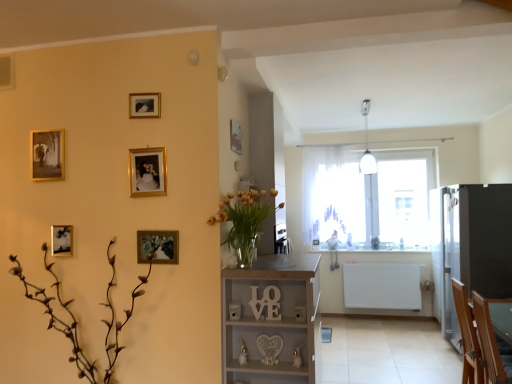
The height and width of the screenshot is (384, 512). What do you see at coordinates (148, 172) in the screenshot?
I see `gold metallic picture frame at upper center, the third picture frame positioned from the right` at bounding box center [148, 172].

The width and height of the screenshot is (512, 384). What do you see at coordinates (367, 145) in the screenshot? I see `white plastic light fixture at upper center` at bounding box center [367, 145].

Describe the element at coordinates (234, 137) in the screenshot. Image resolution: width=512 pixels, height=384 pixels. I see `gold metallic picture frame at upper center, positioned as the sixth picture frame in left-to-right order` at that location.

How much space does gold metallic picture frame at upper center, positioned as the sixth picture frame in left-to-right order, occupy horizontally?

2.14 centimeters.

How much space does gold metallic picture frame at upper center, which ranks as the 3th picture frame in left-to-right order, occupy vertically?

gold metallic picture frame at upper center, which ranks as the 3th picture frame in left-to-right order, is 6.73 inches tall.

Where is `satin black fridge at right`? satin black fridge at right is located at coordinates (470, 246).

Which is more to the left, white sheer curtain at center or gold metallic picture frame at upper center, positioned as the sixth picture frame in left-to-right order?

gold metallic picture frame at upper center, positioned as the sixth picture frame in left-to-right order, is more to the left.

Are white sheer curtain at center and gold metallic picture frame at upper center, the sixth picture frame viewed from the front, beside each other?

No, white sheer curtain at center is not next to gold metallic picture frame at upper center, the sixth picture frame viewed from the front.

Measure the distance from white sheer curtain at center to gold metallic picture frame at upper center, which is the first picture frame from back to front.

The distance of white sheer curtain at center from gold metallic picture frame at upper center, which is the first picture frame from back to front, is 3.68 meters.

Does gold metallic picture frame at upper center, which is the first picture frame from back to front, have a smaller size compared to brown matte plant at lower left?

Yes.

Is gold metallic picture frame at upper center, the sixth picture frame viewed from the front, looking in the opposite direction of brown matte plant at lower left?

No.

Where is `plant that appears below the gold metallic picture frame at upper center, which is the first picture frame from back to front (from the image's perspective)`? The height and width of the screenshot is (384, 512). plant that appears below the gold metallic picture frame at upper center, which is the first picture frame from back to front (from the image's perspective) is located at coordinates (75, 318).

From a real-world perspective, which object stands above the other?

From a 3D spatial view, gold metallic picture frame at upper center, the sixth picture frame viewed from the front, is above.

Is gold metallic picture frame at upper center, which is counted as the fourth picture frame, starting from the left, inside gold metallic picture frame at upper center, positioned as the sixth picture frame in left-to-right order?

No, gold metallic picture frame at upper center, which is counted as the fourth picture frame, starting from the left, is not inside gold metallic picture frame at upper center, positioned as the sixth picture frame in left-to-right order.

In the image, is gold metallic picture frame at upper center, the first picture frame viewed from the right, on the left side or the right side of gold metallic picture frame at upper center, the fifth picture frame from the back?

gold metallic picture frame at upper center, the first picture frame viewed from the right, is to the right of gold metallic picture frame at upper center, the fifth picture frame from the back.

Consider the image. Could you tell me if transparent glass window at center is turned towards satin black fridge at right?

Yes, transparent glass window at center faces towards satin black fridge at right.

Considering the sizes of transparent glass window at center and satin black fridge at right in the image, is transparent glass window at center bigger or smaller than satin black fridge at right?

transparent glass window at center is smaller than satin black fridge at right.

Is point (399, 154) less distant than point (446, 243)?

No, it is not.

The image size is (512, 384). What are the coordinates of `window on the left of satin black fridge at right` in the screenshot? It's located at (334, 195).

Does point (169, 240) come in front of point (454, 339)?

Yes, point (169, 240) is closer to viewer.

Between wooden picture frame at center-left, which is the 6th picture frame from back to front, and satin black fridge at right, which one has more height?

With more height is satin black fridge at right.

Is wooden picture frame at center-left, arranged as the 1th picture frame when viewed from the front, facing away from satin black fridge at right?

Answer: No, wooden picture frame at center-left, arranged as the 1th picture frame when viewed from the front,'s orientation is not away from satin black fridge at right.

Does wooden picture frame at center-left, which is the 6th picture frame from back to front, have a lesser width compared to satin black fridge at right?

Yes.

Looking at the image, does satin black fridge at right seem bigger or smaller compared to brown matte plant at lower left?

Clearly, satin black fridge at right is larger in size than brown matte plant at lower left.

Considering the relative sizes of satin black fridge at right and brown matte plant at lower left in the image provided, is satin black fridge at right thinner than brown matte plant at lower left?

Incorrect, the width of satin black fridge at right is not less than that of brown matte plant at lower left.

Can you confirm if satin black fridge at right is shorter than brown matte plant at lower left?

Incorrect, the height of satin black fridge at right does not fall short of that of brown matte plant at lower left.

How distant is satin black fridge at right from brown matte plant at lower left?

3.94 meters.

Consider the image. Is transparent glass window at center facing towards gold metallic picture frame at upper center, the third picture frame positioned from the right?

Yes.

From a real-world perspective, who is located lower, transparent glass window at center or gold metallic picture frame at upper center, which is counted as the fourth picture frame, starting from the left?

In real-world perspective, transparent glass window at center is lower.

Considering the sizes of objects transparent glass window at center and gold metallic picture frame at upper center, the fifth picture frame from the back, in the image provided, who is shorter, transparent glass window at center or gold metallic picture frame at upper center, the fifth picture frame from the back,?

With less height is gold metallic picture frame at upper center, the fifth picture frame from the back.

Considering the positions of objects transparent glass window at center and gold metallic picture frame at upper center, the third picture frame positioned from the right, in the image provided, who is in front, transparent glass window at center or gold metallic picture frame at upper center, the third picture frame positioned from the right,?

gold metallic picture frame at upper center, the third picture frame positioned from the right, is closer to the camera.

Identify the location of the 1st picture frame in front of the white sheer curtain at center, starting your count from the anchor. This screenshot has width=512, height=384. (234, 137).

At what (x,y) coordinates should I click in order to perform the action: click on plant that is under the gold metallic picture frame at upper center, the first picture frame viewed from the right (from a real-world perspective). Please return your answer as a coordinate pair (x, y). The image size is (512, 384). Looking at the image, I should click on click(x=75, y=318).

Looking at the image, which one is located further to gold metallic picture frame at upper center, the fifth picture frame from the back, white sheer curtain at center or wooden picture frame at center-left, the 2th picture frame from the right?

white sheer curtain at center lies further to gold metallic picture frame at upper center, the fifth picture frame from the back, than the other object.

When comparing their distances from translucent glass vase at center, does white wood shelf at center or brown matte plant at lower left seem further?

brown matte plant at lower left is further to translucent glass vase at center.

Looking at the image, which one is located further to translucent glass vase at center, gold metallic picture frame at upper center, which ranks as the fourth picture frame in back-to-front order, or satin black fridge at right?

The object further to translucent glass vase at center is satin black fridge at right.

When comparing their distances from wooden sign at center, does gold metallic picture frame at upper center, which ranks as the 3th picture frame in left-to-right order, or white sheer curtain at center seem closer?

The object closer to wooden sign at center is gold metallic picture frame at upper center, which ranks as the 3th picture frame in left-to-right order.

Based on their spatial positions, is white plastic light fixture at upper center or translucent glass vase at center closer to gold metallic picture frame at upper left, which is counted as the fourth picture frame, starting from the front?

translucent glass vase at center is closer to gold metallic picture frame at upper left, which is counted as the fourth picture frame, starting from the front.

Which object lies further to the anchor point gold metallic picture frame at upper left, marked as the second picture frame in a back-to-front arrangement, satin black fridge at right or wooden sign at center?

The object further to gold metallic picture frame at upper left, marked as the second picture frame in a back-to-front arrangement, is satin black fridge at right.

Which object lies further to the anchor point gold metallic picture frame at upper center, which is the first picture frame from back to front, wooden sign at center or translucent glass vase at center?

wooden sign at center.

Looking at the image, which one is located closer to white sheer curtain at center, gold metallic picture frame at upper left, which is counted as the fourth picture frame, starting from the front, or gold metallic picture frame at upper center, the second picture frame in the front-to-back sequence?

Among the two, gold metallic picture frame at upper center, the second picture frame in the front-to-back sequence, is located nearer to white sheer curtain at center.

You are a GUI agent. You are given a task and a screenshot of the screen. Output one action in this format:
    pyautogui.click(x=<x>, y=<y>)
    Task: Click on the armchair between gold metallic picture frame at upper center, which is counted as the fourth picture frame, starting from the left, and satin black fridge at right
    This screenshot has width=512, height=384.
    Given the screenshot: What is the action you would take?
    pyautogui.click(x=490, y=341)

What are the coordinates of `shelf between translucent glass vase at center and white plastic light fixture at upper center in the front-back direction` in the screenshot? It's located at (271, 318).

In order to click on armchair between translucent glass vase at center and transparent glass window at center along the z-axis in this screenshot , I will do `click(490, 341)`.

The height and width of the screenshot is (384, 512). What are the coordinates of `fridge located between wooden sign at center and transparent glass window at center in the depth direction` in the screenshot? It's located at (470, 246).